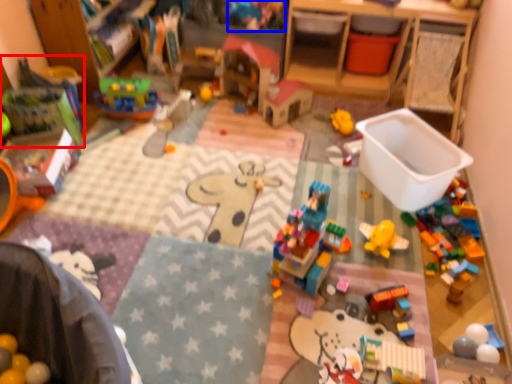
Question: Which object appears closest to the camera in this image, toy (highlighted by a red box) or toy (highlighted by a blue box)?

Choices:
 (A) toy
 (B) toy

Answer: (A)